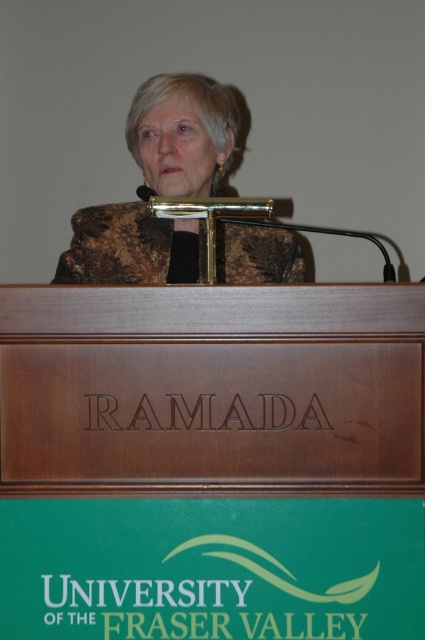
Question: Among these objects, which one is nearest to the camera?

Choices:
 (A) brown polished wood podium at center
 (B) brown textured jacket at center

Answer: (A)

Question: Does brown polished wood podium at center appear over brown textured jacket at center?

Choices:
 (A) yes
 (B) no

Answer: (B)

Question: Is brown polished wood podium at center further to camera compared to brown textured jacket at center?

Choices:
 (A) yes
 (B) no

Answer: (B)

Question: Which object appears closest to the camera in this image?

Choices:
 (A) brown textured jacket at center
 (B) brown polished wood podium at center

Answer: (B)

Question: Which of the following is the closest to the observer?

Choices:
 (A) (163, 90)
 (B) (421, 301)

Answer: (B)

Question: Does brown polished wood podium at center appear on the right side of brown textured jacket at center?

Choices:
 (A) no
 (B) yes

Answer: (B)